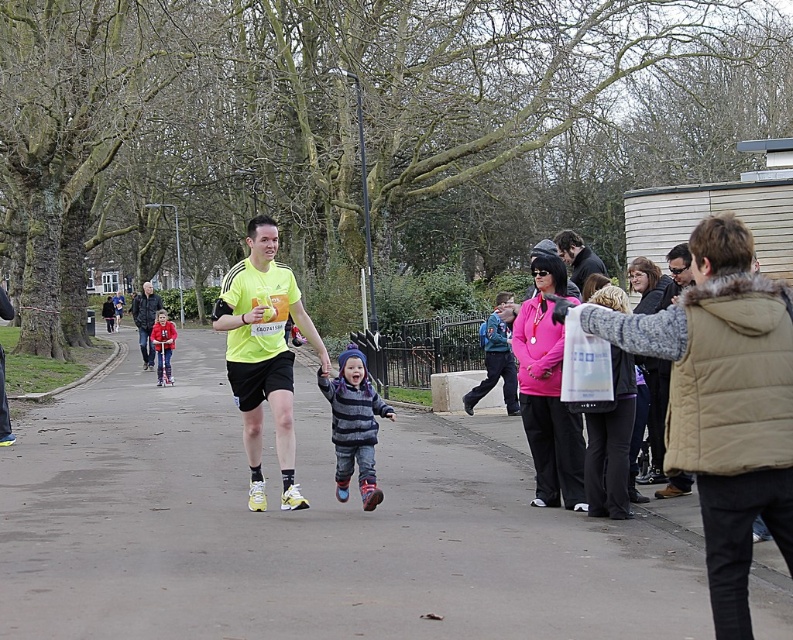
Question: Which object is farther from the camera taking this photo?

Choices:
 (A) matte pink sweater at center
 (B) smooth asphalt road at center
 (C) yellow matte running shirt at center
 (D) matte gray coat at center right

Answer: (A)

Question: Does matte gray coat at center right have a larger size compared to striped fleece jacket at center?

Choices:
 (A) no
 (B) yes

Answer: (B)

Question: Which object is closer to the camera taking this photo?

Choices:
 (A) striped fleece jacket at center
 (B) smooth asphalt road at center
 (C) pink fleece jacket at center

Answer: (B)

Question: Does yellow matte running shirt at center have a lesser width compared to matte pink sweater at center?

Choices:
 (A) yes
 (B) no

Answer: (B)

Question: Is striped fleece jacket at center closer to camera compared to red fleece jacket at center?

Choices:
 (A) yes
 (B) no

Answer: (A)

Question: Estimate the real-world distances between objects in this image. Which object is closer to the matte pink sweater at center?

Choices:
 (A) smooth asphalt road at center
 (B) pink fleece jacket at center
 (C) yellow matte running shirt at center
 (D) striped fleece jacket at center

Answer: (B)